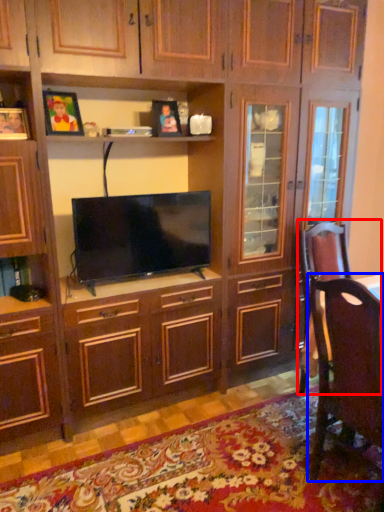
Question: Among these objects, which one is nearest to the camera, swivel chair (highlighted by a red box) or chair (highlighted by a blue box)?

Choices:
 (A) swivel chair
 (B) chair

Answer: (B)